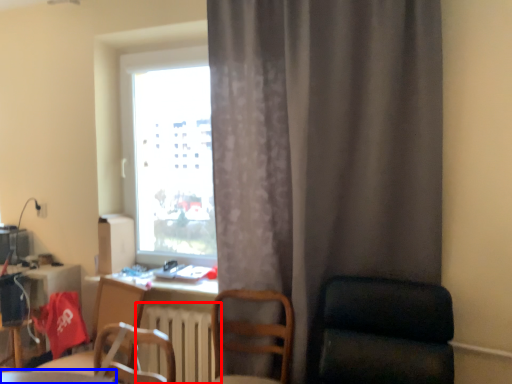
Question: Which of the following is the closest to the observer, radiator (highlighted by a red box) or table (highlighted by a blue box)?

Choices:
 (A) radiator
 (B) table

Answer: (B)